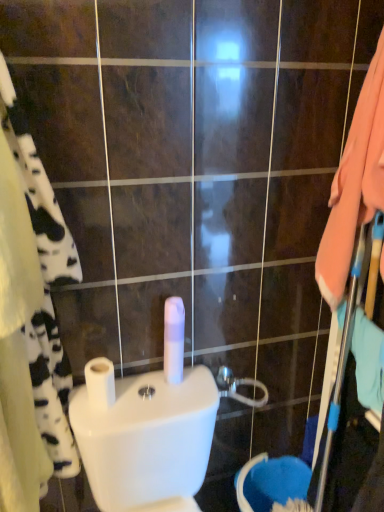
In order to click on free region on the left part of white matte toilet paper at center, the second toilet paper from the left in this screenshot , I will do pos(127,393).